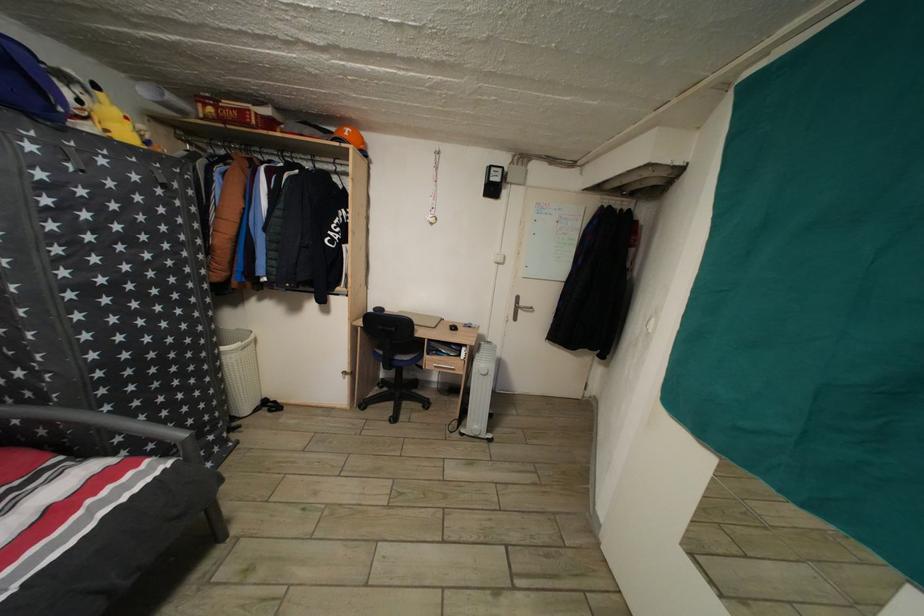
Locate an element on the screen. This screenshot has width=924, height=616. orange helmet is located at coordinates (349, 138).